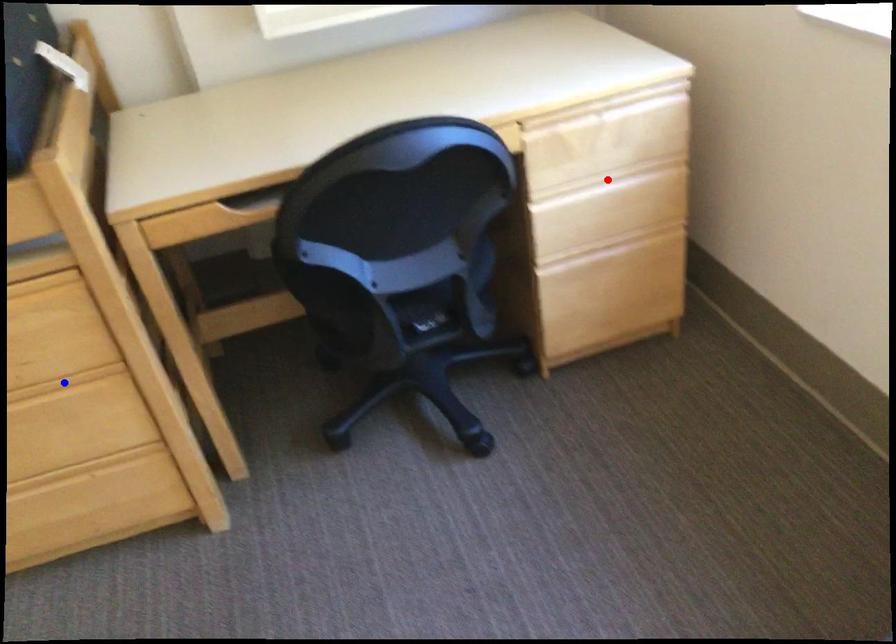
Question: Which of the two points in the image is closer to the camera?

Choices:
 (A) Blue point is closer.
 (B) Red point is closer.

Answer: (A)